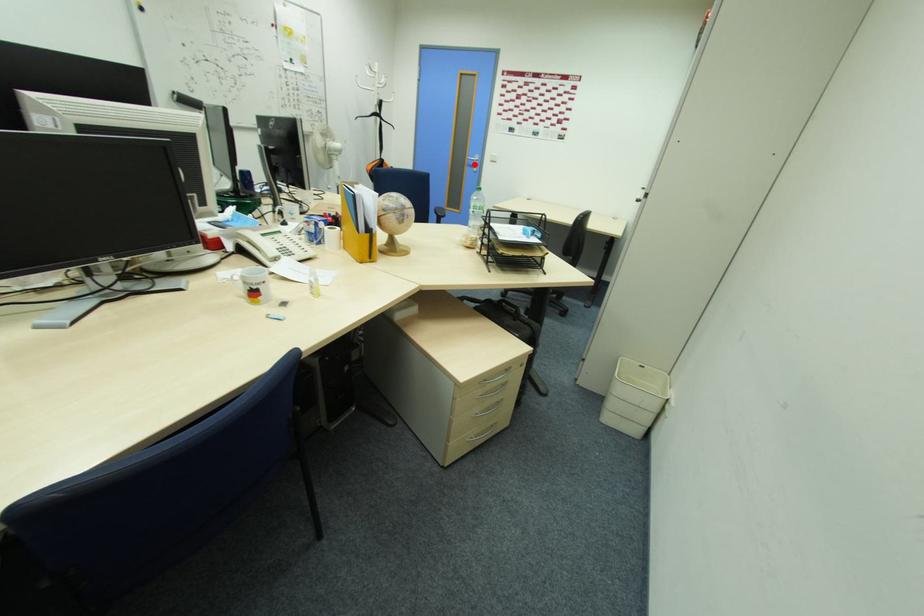
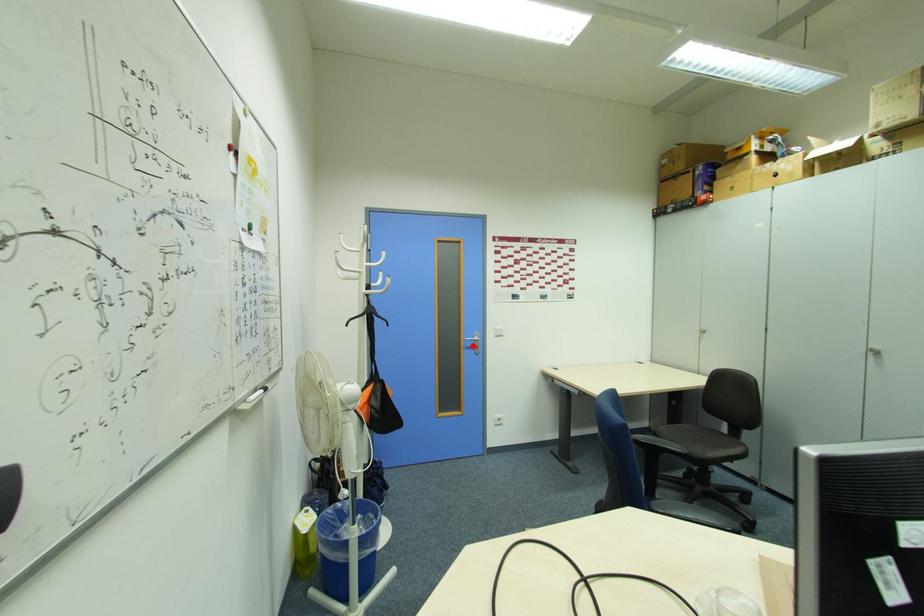
In the scene shown: I am providing you with two images of the same scene from different viewpoints. A red point is marked on the first image and another point is marked on the second image. Are the points marked in image1 and image2 representing the same 3D position?

Yes